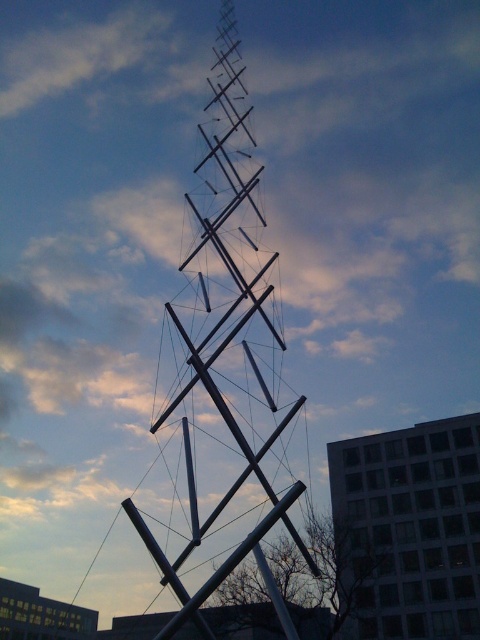
Between silver metallic spire at center and white glass building at center, which one appears on the right side from the viewer's perspective?

white glass building at center is more to the right.

Is silver metallic spire at center taller than white glass building at center?

Indeed, silver metallic spire at center has a greater height compared to white glass building at center.

Which is in front, point (162, 394) or point (444, 536)?

Point (444, 536)

Identify the location of silver metallic spire at center. (223, 371).